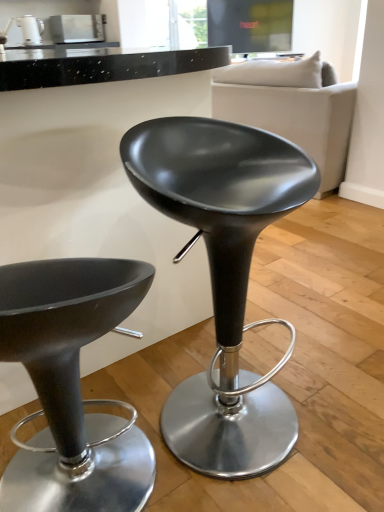
Question: From a real-world perspective, is soft beige fabric couch at upper right physically above matte white kettle at upper left, positioned as the 2th appliance in right-to-left order?

Choices:
 (A) no
 (B) yes

Answer: (A)

Question: Considering the relative positions of soft beige fabric couch at upper right and matte white kettle at upper left, the first appliance viewed from the left, in the image provided, is soft beige fabric couch at upper right to the right of matte white kettle at upper left, the first appliance viewed from the left, from the viewer's perspective?

Choices:
 (A) yes
 (B) no

Answer: (A)

Question: From a real-world perspective, is soft beige fabric couch at upper right below matte white kettle at upper left, positioned as the 2th appliance in right-to-left order?

Choices:
 (A) yes
 (B) no

Answer: (A)

Question: Are soft beige fabric couch at upper right and matte white kettle at upper left, positioned as the 2th appliance in right-to-left order, far apart?

Choices:
 (A) yes
 (B) no

Answer: (A)

Question: Can you confirm if soft beige fabric couch at upper right is bigger than matte white kettle at upper left, positioned as the 2th appliance in right-to-left order?

Choices:
 (A) yes
 (B) no

Answer: (A)

Question: Is matte white kettle at upper left, positioned as the 2th appliance in right-to-left order, inside or outside of soft beige fabric couch at upper right?

Choices:
 (A) inside
 (B) outside

Answer: (B)

Question: Is matte white kettle at upper left, positioned as the 2th appliance in right-to-left order, in front of or behind soft beige fabric couch at upper right in the image?

Choices:
 (A) behind
 (B) front

Answer: (A)

Question: Is point (36, 22) closer or farther from the camera than point (241, 67)?

Choices:
 (A) closer
 (B) farther

Answer: (B)

Question: From a real-world perspective, relative to soft beige fabric couch at upper right, is matte white kettle at upper left, the first appliance viewed from the left, vertically above or below?

Choices:
 (A) below
 (B) above

Answer: (B)

Question: In terms of size, does matte black stool at center, which is counted as the 2th chair, starting from the right, appear bigger or smaller than matte white kettle at upper left, positioned as the 2th appliance in right-to-left order?

Choices:
 (A) small
 (B) big

Answer: (B)

Question: Considering their positions, is matte black stool at center, which is counted as the 2th chair, starting from the right, located in front of or behind matte white kettle at upper left, positioned as the 2th appliance in right-to-left order?

Choices:
 (A) front
 (B) behind

Answer: (A)

Question: Considering the positions of point (110, 315) and point (36, 36), is point (110, 315) closer or farther from the camera than point (36, 36)?

Choices:
 (A) farther
 (B) closer

Answer: (B)

Question: Would you say matte black stool at center, arranged as the 1th chair when viewed from the left, is inside or outside matte white kettle at upper left, the first appliance viewed from the left?

Choices:
 (A) inside
 (B) outside

Answer: (B)

Question: From the image's perspective, is matte black stool at center, arranged as the 1th chair when viewed from the left, located above or below soft beige fabric couch at upper right?

Choices:
 (A) above
 (B) below

Answer: (B)

Question: Is matte black stool at center, which is counted as the 2th chair, starting from the right, inside or outside of soft beige fabric couch at upper right?

Choices:
 (A) outside
 (B) inside

Answer: (A)